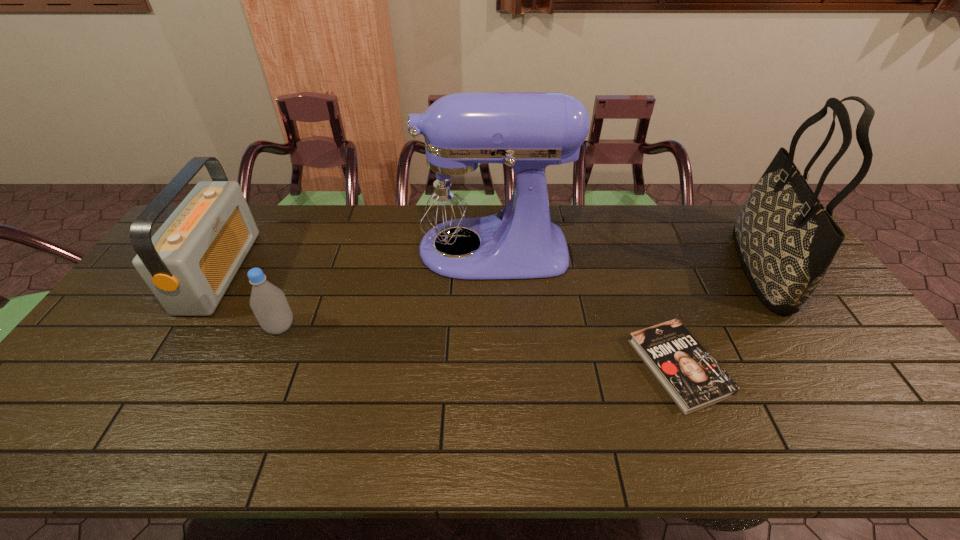
Where is `vacant region that satisfies the following two spatial constraints: 1. on the front-facing side of the third tallest object; 2. on the left side of the bottle`? This screenshot has width=960, height=540. vacant region that satisfies the following two spatial constraints: 1. on the front-facing side of the third tallest object; 2. on the left side of the bottle is located at coordinates (185, 327).

Locate an element on the screen. free space that satisfies the following two spatial constraints: 1. at the mixing area of the mixer; 2. on the front side of the bottle is located at coordinates (489, 327).

Image resolution: width=960 pixels, height=540 pixels. I want to click on free location that satisfies the following two spatial constraints: 1. on the front-facing side of the book; 2. on the right side of the leftmost object, so click(160, 367).

The image size is (960, 540). I want to click on vacant position in the image that satisfies the following two spatial constraints: 1. on the front-facing side of the book; 2. on the right side of the third tallest object, so click(x=160, y=367).